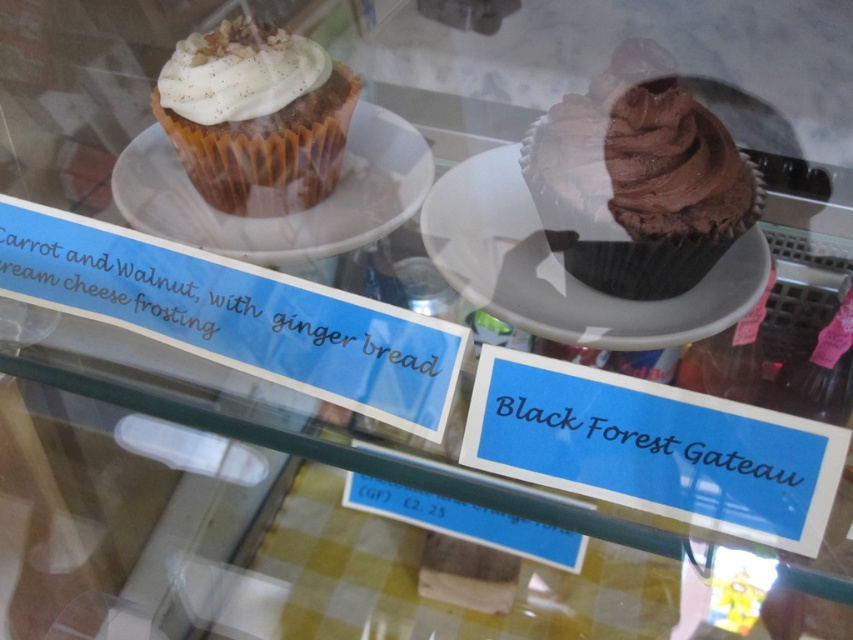
You are a customer at the bakery and want to know if the chocolate matte cupcake at right will fit in your bag that can only hold items up to the height of the matte white plate at center. Can it fit?

The chocolate matte cupcake at right is thinner than the matte white plate at center, so it will fit in your bag.

You are a customer at the bakery and want to know if the chocolate matte cupcake at right will fit on the white paper plate at upper left. Based on their sizes, can it fit?

The chocolate matte cupcake at right has a smaller size compared to the white paper plate at upper left, so it can fit on the plate.